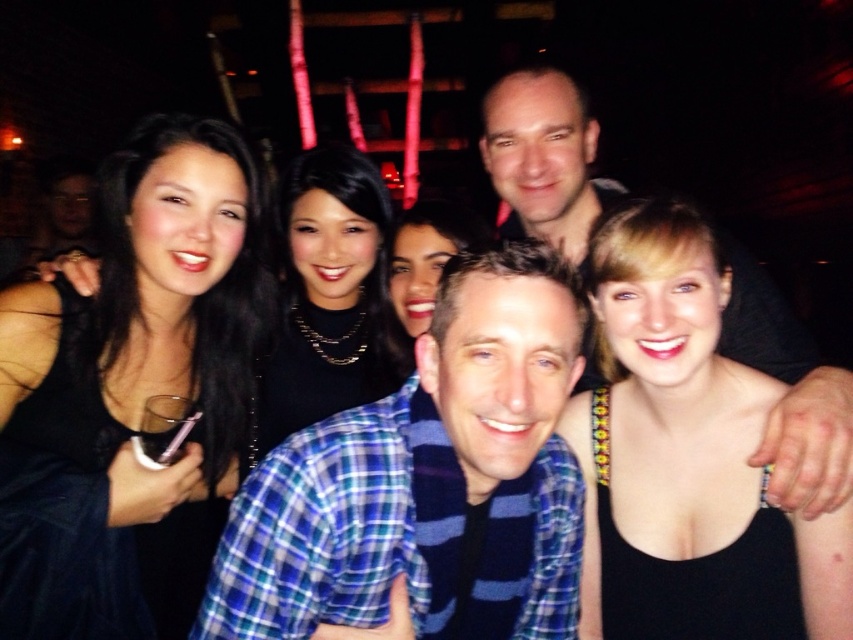
Question: Which point is closer to the camera?

Choices:
 (A) matte black shirt at upper center
 (B) black satin dress at upper left

Answer: (B)

Question: Does blue plaid shirt at center appear over matte black dress at center?

Choices:
 (A) no
 (B) yes

Answer: (A)

Question: Among these objects, which one is nearest to the camera?

Choices:
 (A) blue plaid shirt at center
 (B) matte black dress at center

Answer: (A)

Question: Is black satin dress at upper left behind black satin dress at center?

Choices:
 (A) yes
 (B) no

Answer: (B)

Question: Which object appears farthest from the camera in this image?

Choices:
 (A) matte black dress at center
 (B) black satin dress at upper left
 (C) matte black shirt at upper center

Answer: (A)

Question: Is blue plaid shirt at center bigger than matte black shirt at upper center?

Choices:
 (A) no
 (B) yes

Answer: (B)